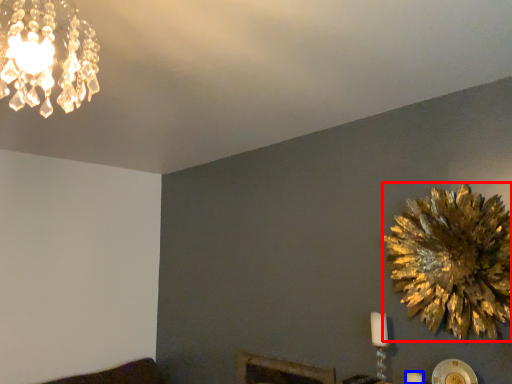
Question: Which point is closer to the camera, flower (highlighted by a red box) or candle (highlighted by a blue box)?

Choices:
 (A) flower
 (B) candle

Answer: (A)